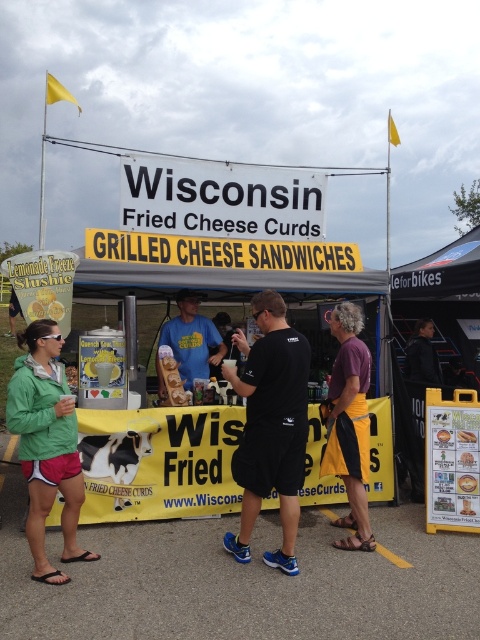
Does purple cotton shirt at center appear on the right side of blue cotton shirt at center?

Indeed, purple cotton shirt at center is positioned on the right side of blue cotton shirt at center.

Consider the image. Which of these two, purple cotton shirt at center or blue cotton shirt at center, stands shorter?

blue cotton shirt at center is shorter.

Between point (338, 518) and point (204, 340), which one is positioned in front?

Positioned in front is point (338, 518).

Identify the location of purple cotton shirt at center. The width and height of the screenshot is (480, 640). (349, 422).

Who is higher up, green matte jacket at lower left or blue cotton shirt at center?

blue cotton shirt at center is above.

Does green matte jacket at lower left appear under blue cotton shirt at center?

Correct, green matte jacket at lower left is located below blue cotton shirt at center.

Which is behind, point (32, 342) or point (186, 371)?

The point (186, 371) is behind.

Find the location of `green matte jacket at lower left`. green matte jacket at lower left is located at coordinates (47, 444).

Describe the element at coordinates (192, 339) in the screenshot. I see `blue cotton shirt at center` at that location.

At what (x,y) coordinates should I click in order to perform the action: click on blue cotton shirt at center. Please return your answer as a coordinate pair (x, y). Looking at the image, I should click on (192, 339).